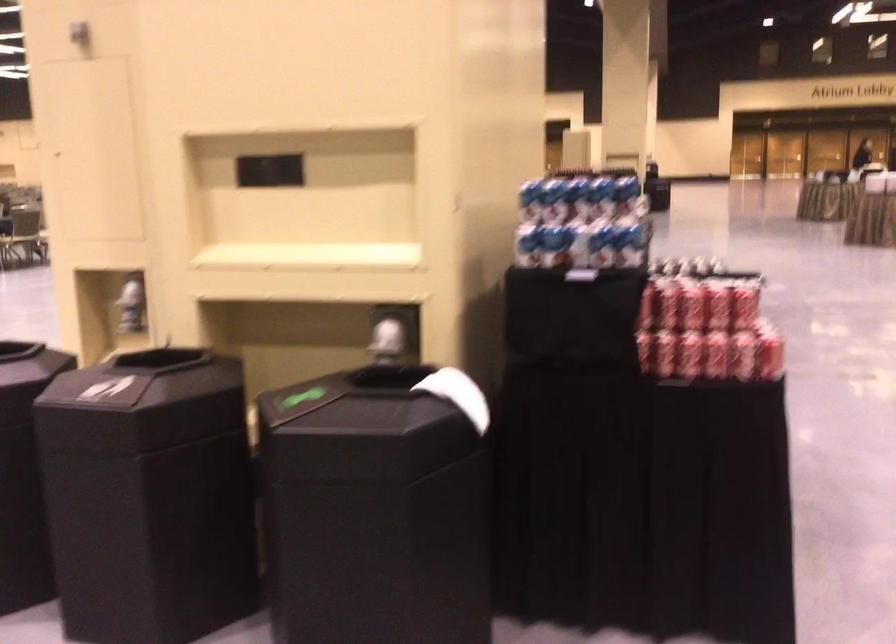
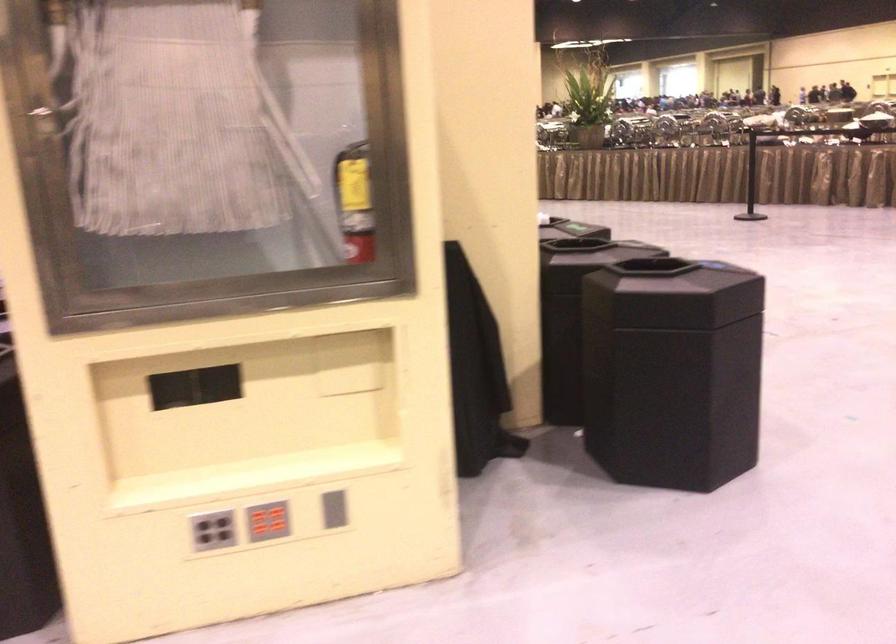
Question: I am providing you with two images of the same scene from different viewpoints. Which of the following objects are not visible in image2?

Choices:
 (A) red button panel
 (B) black network plug
 (C) black trash can lid
 (D) red soda can

Answer: (D)